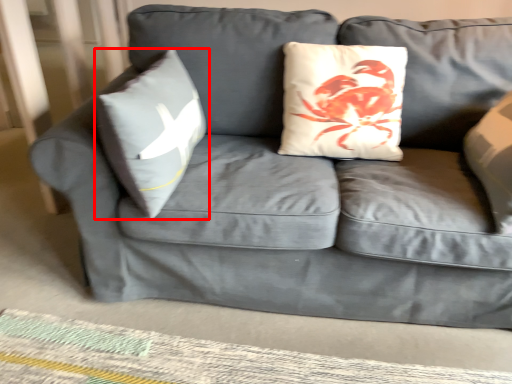
Question: From the image's perspective, where is pillow (annotated by the red box) located in relation to mat in the image?

Choices:
 (A) above
 (B) below

Answer: (A)